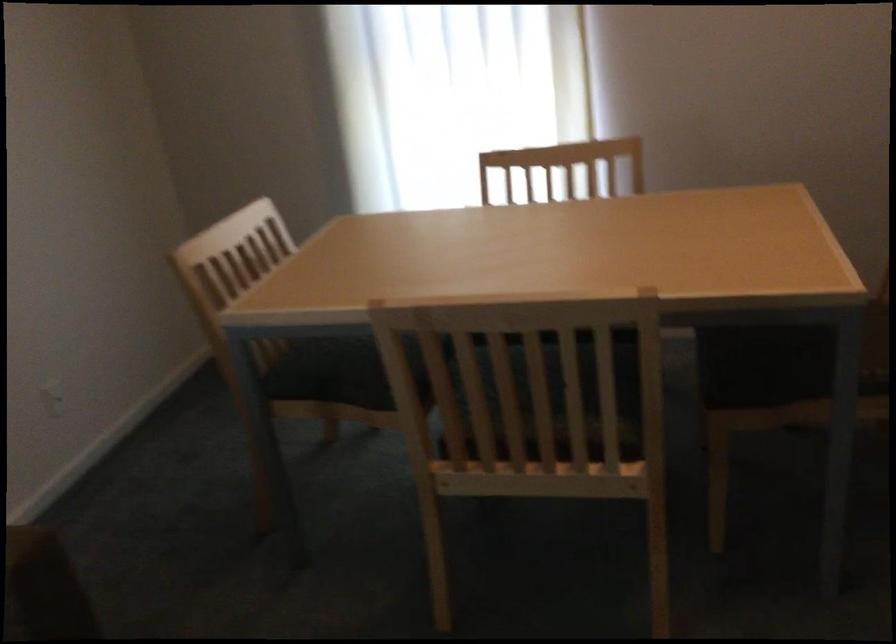
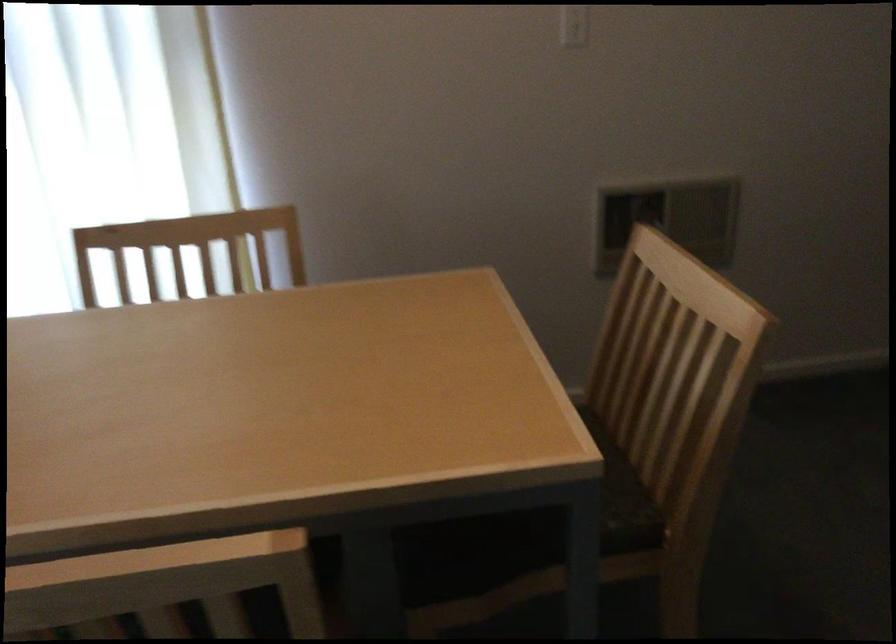
Question: The camera is either moving clockwise (left) or counter-clockwise (right) around the object. The first image is from the beginning of the video and the second image is from the end. Is the camera moving left or right when shooting the video?

Choices:
 (A) Left
 (B) Right

Answer: (A)